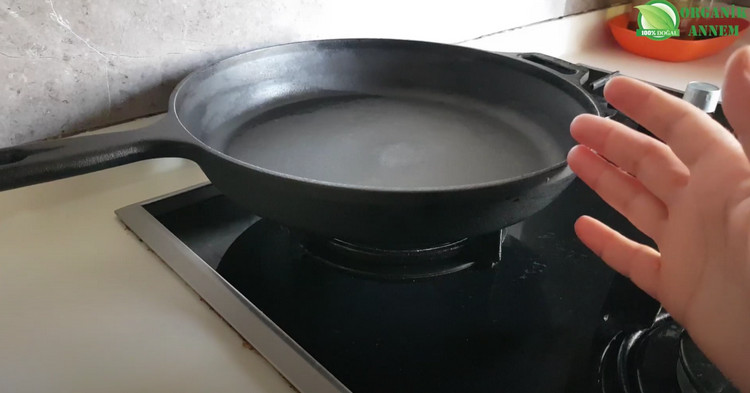
The width and height of the screenshot is (750, 393). What are the coordinates of `dirt under left silver trim on stove edge` in the screenshot? It's located at (247, 345), (208, 304), (126, 225).